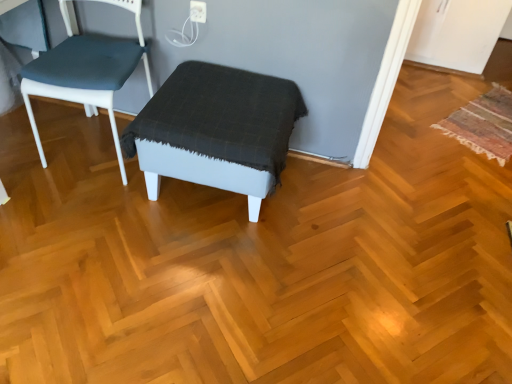
The height and width of the screenshot is (384, 512). Describe the element at coordinates (217, 128) in the screenshot. I see `matte gray stool at center` at that location.

The height and width of the screenshot is (384, 512). What do you see at coordinates (198, 11) in the screenshot?
I see `white plastic electric outlet at upper center` at bounding box center [198, 11].

This screenshot has width=512, height=384. In order to click on white plastic electric outlet at upper center in this screenshot , I will do `click(198, 11)`.

Locate an element on the screen. The width and height of the screenshot is (512, 384). matte blue fabric chair at left is located at coordinates (86, 70).

Considering the positions of point (495, 136) and point (229, 157), is point (495, 136) closer or farther from the camera than point (229, 157)?

Point (495, 136) is positioned farther from the camera compared to point (229, 157).

Is multicolored woven mat at right in contact with matte gray stool at center?

No, multicolored woven mat at right is not next to matte gray stool at center.

Between multicolored woven mat at right and matte gray stool at center, which one has less height?

Standing shorter between the two is multicolored woven mat at right.

Could matte gray stool at center be considered to be inside multicolored woven mat at right?

No, matte gray stool at center is not surrounded by multicolored woven mat at right.

In the scene shown: Considering the relative sizes of matte blue fabric chair at left and matte gray stool at center in the image provided, is matte blue fabric chair at left smaller than matte gray stool at center?

Indeed, matte blue fabric chair at left has a smaller size compared to matte gray stool at center.

How many degrees apart are the facing directions of matte blue fabric chair at left and matte gray stool at center?

They differ by 0.222 degrees in their facing directions.

This screenshot has height=384, width=512. In order to click on chair that appears above the matte gray stool at center (from the image's perspective) in this screenshot , I will do `click(86, 70)`.

Between matte gray stool at center and matte blue fabric chair at left, which one has smaller size?

matte blue fabric chair at left.

In the image, is matte gray stool at center positioned in front of or behind matte blue fabric chair at left?

Clearly, matte gray stool at center is behind matte blue fabric chair at left.

Consider the image. Does matte gray stool at center have a lesser height compared to matte blue fabric chair at left?

Yes.

From the image's perspective, who appears lower, white plastic electric outlet at upper center or matte gray stool at center?

matte gray stool at center, from the image's perspective.

Considering their positions, is white plastic electric outlet at upper center located in front of or behind matte gray stool at center?

white plastic electric outlet at upper center is behind matte gray stool at center.

From a real-world perspective, who is located lower, white plastic electric outlet at upper center or matte gray stool at center?

matte gray stool at center.

Considering the relative positions of white plastic electric outlet at upper center and multicolored woven mat at right in the image provided, is white plastic electric outlet at upper center to the left or to the right of multicolored woven mat at right?

In the image, white plastic electric outlet at upper center appears on the left side of multicolored woven mat at right.

Which is behind, point (193, 14) or point (485, 148)?

The point (485, 148) is behind.

From the image's perspective, is white plastic electric outlet at upper center on top of multicolored woven mat at right?

Yes, from the image's perspective, white plastic electric outlet at upper center is over multicolored woven mat at right.

How different are the orientations of white plastic electric outlet at upper center and multicolored woven mat at right in degrees?

white plastic electric outlet at upper center and multicolored woven mat at right are facing 36.2 degrees away from each other.

From a real-world perspective, is multicolored woven mat at right physically located above or below white plastic electric outlet at upper center?

From a real-world perspective, multicolored woven mat at right is physically below white plastic electric outlet at upper center.

Considering the sizes of objects multicolored woven mat at right and white plastic electric outlet at upper center in the image provided, who is taller, multicolored woven mat at right or white plastic electric outlet at upper center?

Standing taller between the two is white plastic electric outlet at upper center.

Is multicolored woven mat at right located outside white plastic electric outlet at upper center?

multicolored woven mat at right is positioned outside white plastic electric outlet at upper center.

Is matte gray stool at center positioned beyond the bounds of white plastic electric outlet at upper center?

That's correct, matte gray stool at center is outside of white plastic electric outlet at upper center.

Is matte gray stool at center looking in the opposite direction of white plastic electric outlet at upper center?

No, matte gray stool at center is not facing the opposite direction of white plastic electric outlet at upper center.

From the picture: From the image's perspective, is matte gray stool at center under white plastic electric outlet at upper center?

Yes, from the image's perspective, matte gray stool at center is beneath white plastic electric outlet at upper center.

From a real-world perspective, who is located higher, matte gray stool at center or white plastic electric outlet at upper center?

From a 3D spatial view, white plastic electric outlet at upper center is above.

At what (x,y) coordinates should I click in order to perform the action: click on stool that appears in front of the multicolored woven mat at right. Please return your answer as a coordinate pair (x, y). This screenshot has width=512, height=384. Looking at the image, I should click on (217, 128).

Locate an element on the screen. stool below the matte blue fabric chair at left (from the image's perspective) is located at coordinates (217, 128).

Which object lies further to the anchor point matte gray stool at center, matte blue fabric chair at left or white plastic electric outlet at upper center?

white plastic electric outlet at upper center lies further to matte gray stool at center than the other object.

Considering their positions, is multicolored woven mat at right positioned closer to white plastic electric outlet at upper center than matte blue fabric chair at left?

Based on the image, matte blue fabric chair at left appears to be nearer to white plastic electric outlet at upper center.

From the picture: Estimate the real-world distances between objects in this image. Which object is closer to matte gray stool at center, matte blue fabric chair at left or multicolored woven mat at right?

matte blue fabric chair at left is positioned closer to the anchor matte gray stool at center.

From the image, which object appears to be farther from matte gray stool at center, white plastic electric outlet at upper center or multicolored woven mat at right?

multicolored woven mat at right is positioned further to the anchor matte gray stool at center.

Based on their spatial positions, is matte blue fabric chair at left or multicolored woven mat at right closer to white plastic electric outlet at upper center?

matte blue fabric chair at left is closer to white plastic electric outlet at upper center.

Estimate the real-world distances between objects in this image. Which object is further from multicolored woven mat at right, matte blue fabric chair at left or white plastic electric outlet at upper center?

matte blue fabric chair at left is positioned further to the anchor multicolored woven mat at right.

From the image, which object appears to be farther from matte gray stool at center, multicolored woven mat at right or matte blue fabric chair at left?

Based on the image, multicolored woven mat at right appears to be further to matte gray stool at center.

Which object lies nearer to the anchor point white plastic electric outlet at upper center, matte gray stool at center or matte blue fabric chair at left?

matte gray stool at center.

Where is `electric outlet between matte blue fabric chair at left and matte gray stool at center in the horizontal direction`? Image resolution: width=512 pixels, height=384 pixels. electric outlet between matte blue fabric chair at left and matte gray stool at center in the horizontal direction is located at coordinates (198, 11).

The width and height of the screenshot is (512, 384). Find the location of `electric outlet between matte blue fabric chair at left and multicolored woven mat at right from left to right`. electric outlet between matte blue fabric chair at left and multicolored woven mat at right from left to right is located at coordinates (198, 11).

The height and width of the screenshot is (384, 512). I want to click on stool between white plastic electric outlet at upper center and multicolored woven mat at right from left to right, so pos(217,128).

The width and height of the screenshot is (512, 384). Find the location of `stool between matte blue fabric chair at left and multicolored woven mat at right`. stool between matte blue fabric chair at left and multicolored woven mat at right is located at coordinates (217, 128).